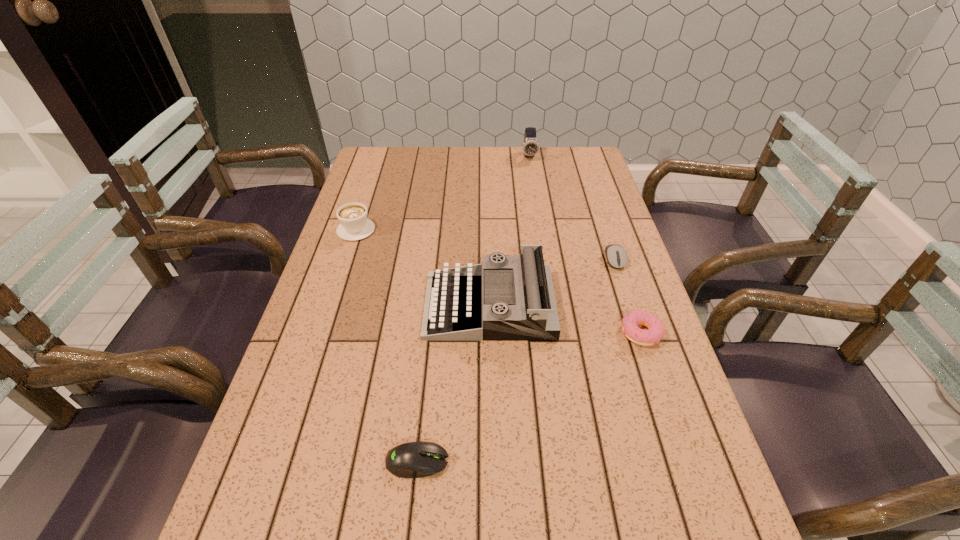
You are a GUI agent. You are given a task and a screenshot of the screen. Output one action in this format:
    pyautogui.click(x=<x>, y=<y>)
    Task: Click on the vacant space that satisfies the following two spatial constraints: 1. on the face of the farthest object; 2. on the right side of the doughnut
    This screenshot has height=540, width=960.
    Given the screenshot: What is the action you would take?
    pyautogui.click(x=558, y=333)

What are the coordinates of `free space that satisfies the following two spatial constraints: 1. on the back side of the doughnut; 2. on the typing side of the typewriter` in the screenshot? It's located at (633, 306).

Find the location of a particular element. Image resolution: width=960 pixels, height=540 pixels. free space that satisfies the following two spatial constraints: 1. on the typing side of the typewriter; 2. on the right side of the doughnut is located at coordinates (490, 333).

In order to click on free space that satisfies the following two spatial constraints: 1. on the wheel side of the right computer mouse; 2. on the typing side of the typewriter in this screenshot , I will do `click(630, 306)`.